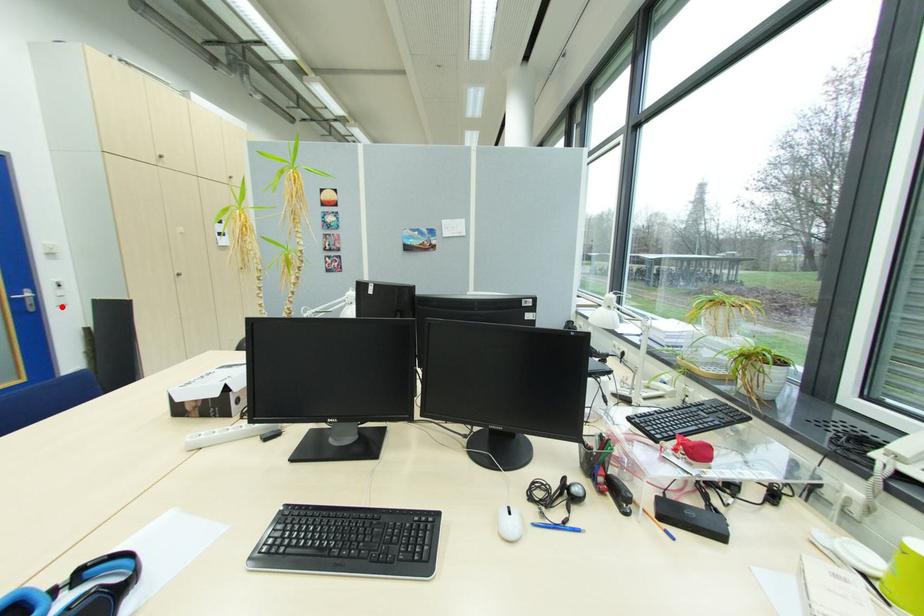
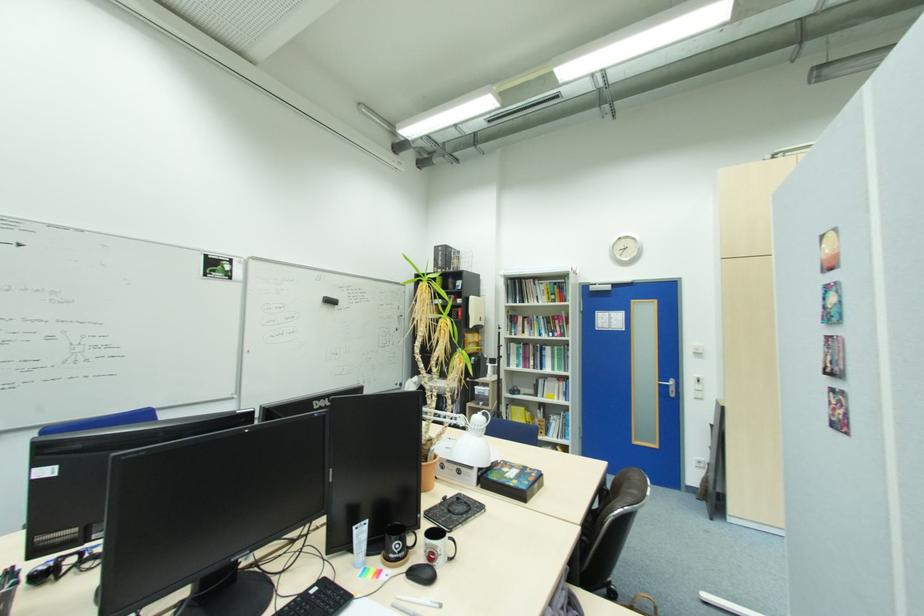
Find the pixel in the second image that matches the highlighted location in the first image.

(699, 399)